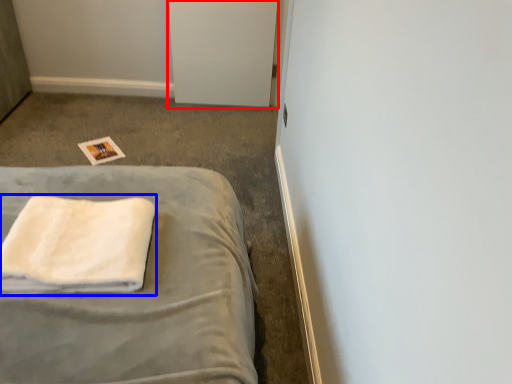
Question: Among these objects, which one is farthest to the camera, file cabinet (highlighted by a red box) or towel (highlighted by a blue box)?

Choices:
 (A) file cabinet
 (B) towel

Answer: (A)